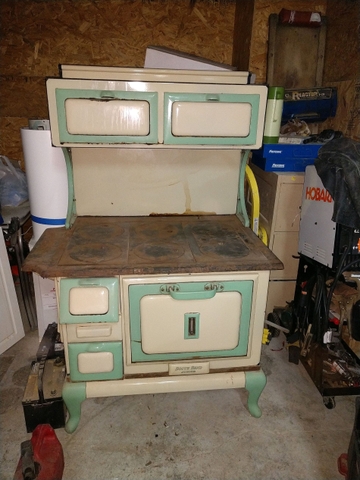
Find the location of a particular element. The width and height of the screenshot is (360, 480). doors is located at coordinates (125, 118), (202, 124), (160, 309), (94, 304), (93, 353).